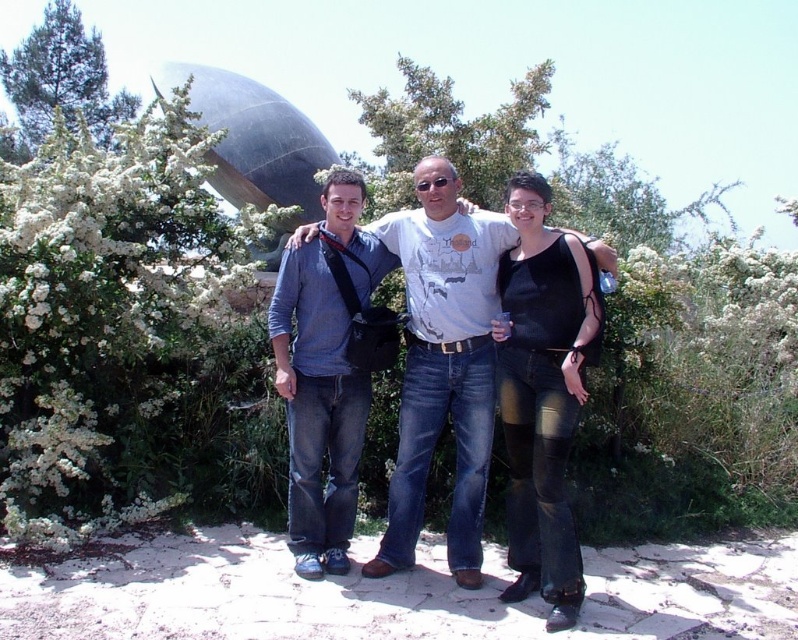
You are a photographer standing at the edge of the paved area in the park. You want to take a photo of the white fluffy bush at left and the denim jeans at center so that both are in focus. Given that your camera can only maintain focus within a 6 feet range, can you capture both subjects clearly in one shot?

The white fluffy bush at left is 6.51 feet away from the denim jeans at center. Since the distance between them exceeds the camera focus range of 6 feet, you cannot capture both subjects clearly in one shot.

In the scene shown: You are a photographer trying to capture a group photo of the three people in the scene. The white fluffy bush at left and the black mesh top at center are in the background. Which object would appear larger in the photo?

The white fluffy bush at left would appear larger in the photo because it is much taller than the black mesh top at center.

You are taking a group photo of three people in a park. The scene includes a white fluffy bush at left and denim jeans at center. From the photographer perspective, which object is positioned to the left of the other?

The white fluffy bush at left is positioned to the left of denim jeans at center.